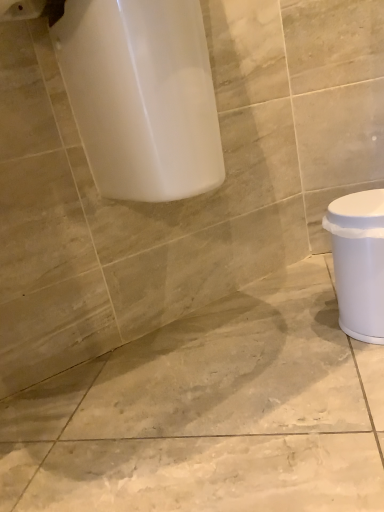
In order to face white plastic waste bin at lower right, should I rotate leftwards or rightwards?

Rotate your view right by about 23.598°.

At what (x,y) coordinates should I click in order to perform the action: click on white plastic waste bin at lower right. Please return your answer as a coordinate pair (x, y). The width and height of the screenshot is (384, 512). Looking at the image, I should click on click(359, 262).

Describe the element at coordinates (359, 262) in the screenshot. The width and height of the screenshot is (384, 512). I see `white plastic waste bin at lower right` at that location.

This screenshot has width=384, height=512. I want to click on white plastic waste bin at lower right, so click(359, 262).